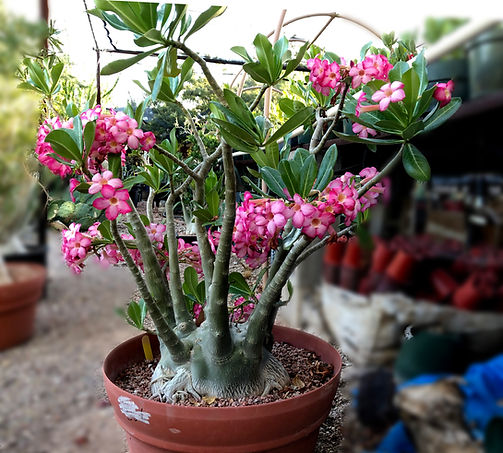
Identify the location of top rim of red clay pot. Image resolution: width=503 pixels, height=453 pixels. (244, 431).